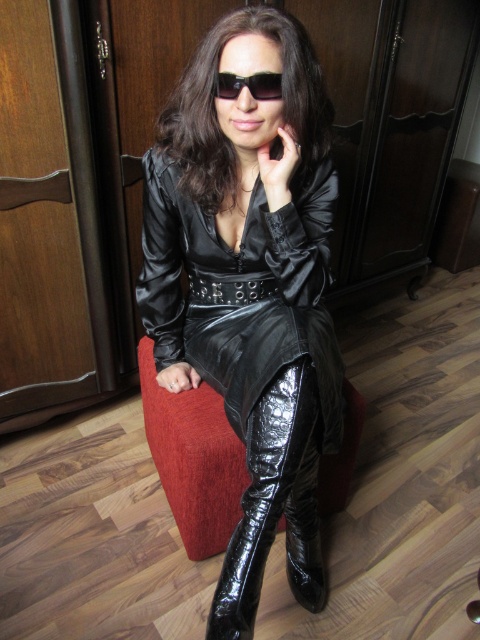
From the picture: You are a fashion designer trying to create a cohesive look for a photoshoot. You have the glossy leather dress at center and the glossy black leather jacket at center. Based on their positions in the image, which item is located to the left of the other?

The glossy leather dress at center is positioned on the left side of the glossy black leather jacket at center.

You are a fashion designer observing the image. You need to determine the spatial relationship between the glossy patent leather boot at lower center and the black glossy sunglasses at center. Which object is positioned lower in the image?

The glossy patent leather boot at lower center is positioned lower than the black glossy sunglasses at center.